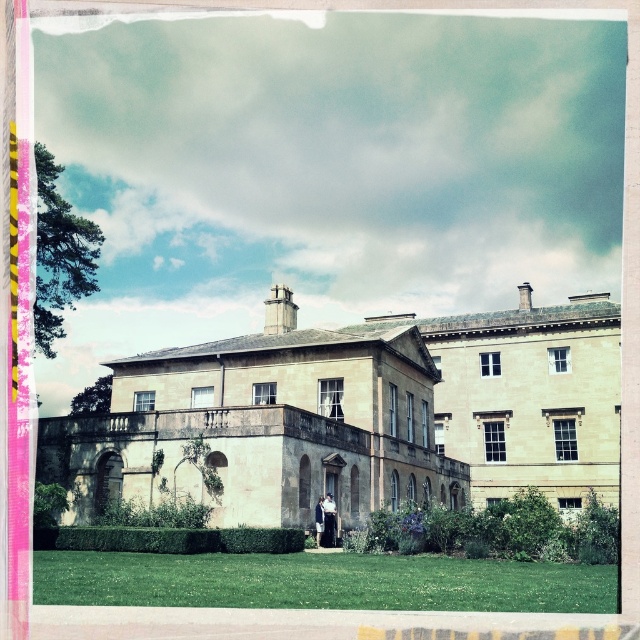
Question: Observing the image, what is the correct spatial positioning of green grass at lower center in reference to dark blue jacket at center?

Choices:
 (A) left
 (B) right

Answer: (B)

Question: Is beige stone mansion at center bigger than dark blue jacket at center?

Choices:
 (A) no
 (B) yes

Answer: (B)

Question: Among these objects, which one is farthest from the camera?

Choices:
 (A) dark blue jacket at center
 (B) light blue fabric coat at center
 (C) beige stone mansion at center
 (D) green grass at lower center

Answer: (B)

Question: Can you confirm if beige stone mansion at center is positioned above light blue fabric coat at center?

Choices:
 (A) no
 (B) yes

Answer: (B)

Question: Which of the following is the closest to the observer?

Choices:
 (A) light blue fabric coat at center
 (B) dark blue jacket at center
 (C) beige stone mansion at center
 (D) green grass at lower center

Answer: (D)

Question: Which point is farther to the camera?

Choices:
 (A) (326, 532)
 (B) (317, 515)
 (C) (406, 604)

Answer: (A)